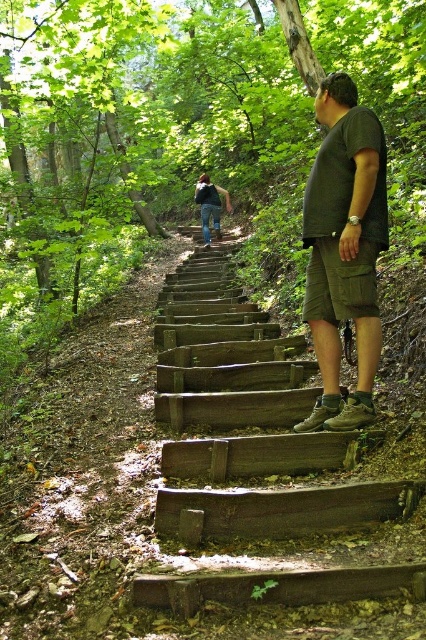
Is weathered wood stairs at center to the left of blue jeans at upper center from the viewer's perspective?

No, weathered wood stairs at center is not to the left of blue jeans at upper center.

Which of these two, weathered wood stairs at center or blue jeans at upper center, stands shorter?

weathered wood stairs at center

Does point (264, 513) come closer to viewer compared to point (204, 228)?

That is True.

Image resolution: width=426 pixels, height=640 pixels. I want to click on weathered wood stairs at center, so click(x=233, y=385).

Does point (311, 291) come in front of point (201, 195)?

Yes.

Who is positioned more to the left, dark green t-shirt at center or blue jeans at upper center?

From the viewer's perspective, blue jeans at upper center appears more on the left side.

Looking at this image, who is more distant from viewer, (345, 156) or (216, 221)?

Point (216, 221)

At what (x,y) coordinates should I click in order to perform the action: click on dark green t-shirt at center. Please return your answer as a coordinate pair (x, y). This screenshot has height=640, width=426. Looking at the image, I should click on (344, 248).

How much distance is there between weathered wood stairs at center and dark green t-shirt at center?

weathered wood stairs at center is 6.23 feet from dark green t-shirt at center.

Does weathered wood stairs at center have a greater height compared to dark green t-shirt at center?

Incorrect, weathered wood stairs at center's height is not larger of dark green t-shirt at center's.

Who is more distant from viewer, (224, 316) or (348, 96)?

Point (224, 316)

Find the location of a particular element. The image size is (426, 640). weathered wood stairs at center is located at coordinates (233, 385).